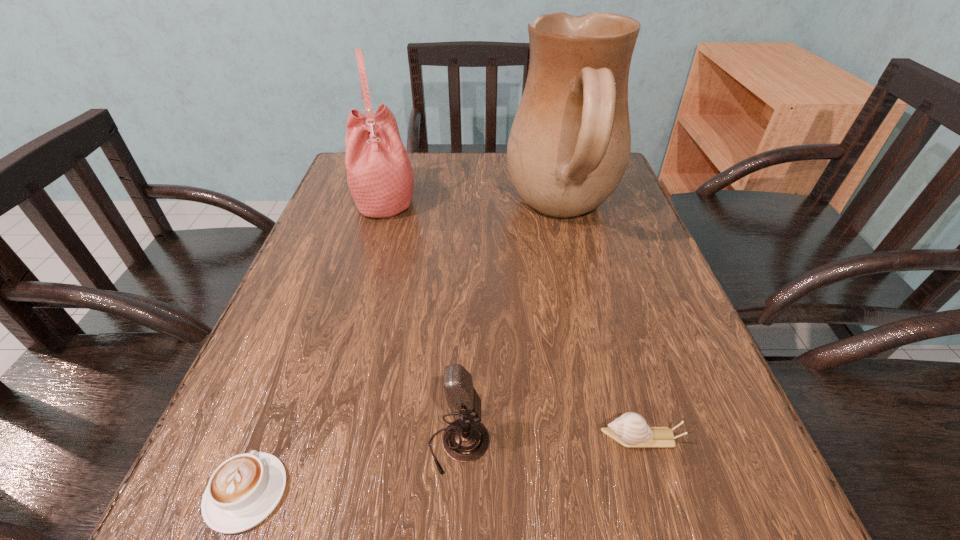
Find the location of a particular element. cream pitcher is located at coordinates pos(569,146).

I want to click on the second tallest object, so click(x=380, y=177).

Where is `the third shortest object`? the third shortest object is located at coordinates (466, 439).

The width and height of the screenshot is (960, 540). I want to click on microphone, so click(x=466, y=439).

Where is `escargot`? escargot is located at coordinates (630, 429).

Where is `cappuccino`? cappuccino is located at coordinates (244, 490).

Locate an element on the screen. free space located at the spout of the cream pitcher is located at coordinates (429, 213).

Locate an element on the screen. The image size is (960, 540). vacant space situated at the spout of the cream pitcher is located at coordinates tap(395, 213).

Locate an element on the screen. The image size is (960, 540). blank space located 0.130m at the spout of the cream pitcher is located at coordinates (450, 213).

Find the location of a particular element. vacant region located on the front of the second tallest object is located at coordinates (373, 237).